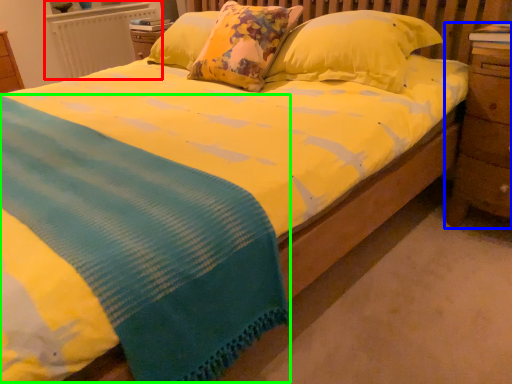
Question: Based on their relative distances, which object is farther from radiator (highlighted by a red box)? Choose from nightstand (highlighted by a blue box) and blanket (highlighted by a green box).

Choices:
 (A) nightstand
 (B) blanket

Answer: (A)